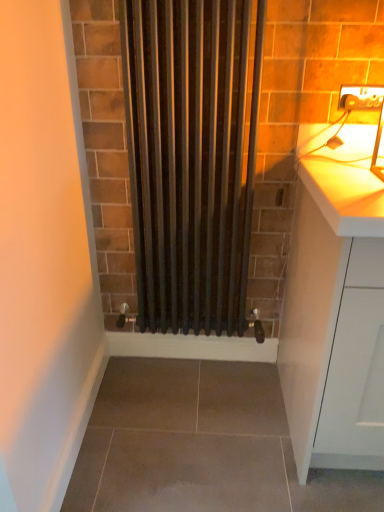
Question: Is white matte cabinet at right thinner than black matte radiator at center?

Choices:
 (A) yes
 (B) no

Answer: (B)

Question: Considering the relative sizes of white matte cabinet at right and black matte radiator at center in the image provided, is white matte cabinet at right wider than black matte radiator at center?

Choices:
 (A) no
 (B) yes

Answer: (B)

Question: Would you say white matte cabinet at right contains black matte radiator at center?

Choices:
 (A) yes
 (B) no

Answer: (B)

Question: Considering the relative sizes of white matte cabinet at right and black matte radiator at center in the image provided, is white matte cabinet at right taller than black matte radiator at center?

Choices:
 (A) no
 (B) yes

Answer: (A)

Question: Is white matte cabinet at right closer to the viewer compared to black matte radiator at center?

Choices:
 (A) yes
 (B) no

Answer: (A)

Question: From the image's perspective, is white matte cabinet at right positioned above or below black matte radiator at center?

Choices:
 (A) above
 (B) below

Answer: (B)

Question: Is white matte cabinet at right taller or shorter than black matte radiator at center?

Choices:
 (A) short
 (B) tall

Answer: (A)

Question: In the image, is white matte cabinet at right on the left side or the right side of black matte radiator at center?

Choices:
 (A) right
 (B) left

Answer: (A)

Question: Looking at their shapes, would you say white matte cabinet at right is wider or thinner than black matte radiator at center?

Choices:
 (A) wide
 (B) thin

Answer: (A)

Question: From a real-world perspective, is black matte radiator at center physically located above or below white matte cabinet at right?

Choices:
 (A) above
 (B) below

Answer: (A)

Question: From the image's perspective, is black matte radiator at center located above or below white matte cabinet at right?

Choices:
 (A) above
 (B) below

Answer: (A)

Question: Is black matte radiator at center spatially inside white matte cabinet at right, or outside of it?

Choices:
 (A) inside
 (B) outside

Answer: (B)

Question: In terms of height, does black matte radiator at center look taller or shorter compared to white matte cabinet at right?

Choices:
 (A) tall
 (B) short

Answer: (A)

Question: From a real-world perspective, is matte white electric outlet at upper right physically located above or below white matte cabinet at right?

Choices:
 (A) above
 (B) below

Answer: (A)

Question: From the image's perspective, is matte white electric outlet at upper right above or below white matte cabinet at right?

Choices:
 (A) above
 (B) below

Answer: (A)